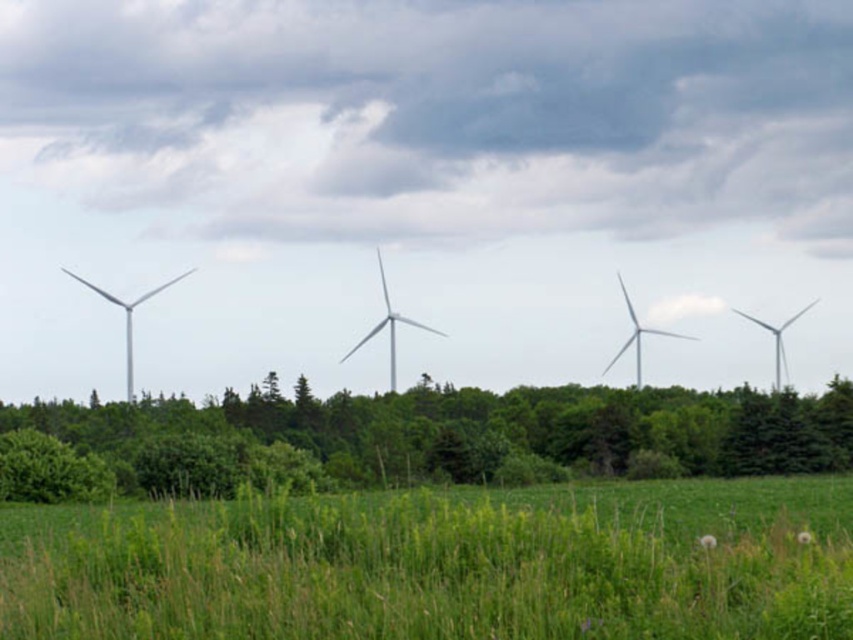
You are standing at the point marked by coordinates point [485,428] in the image. What object is located exactly at this point?

The green leafy tree at lower center is located exactly at point [485,428].

You are a photographer planning to capture a landscape photo that includes both the green leafy tree at lower center and the white matte wind turbine at center. Based on their widths, which object should you position closer to the edge of the frame to ensure both fit within the shot?

Since the green leafy tree at lower center might be wider than the white matte wind turbine at center, you should position the green leafy tree at lower center closer to the edge to accommodate its greater width within the frame.